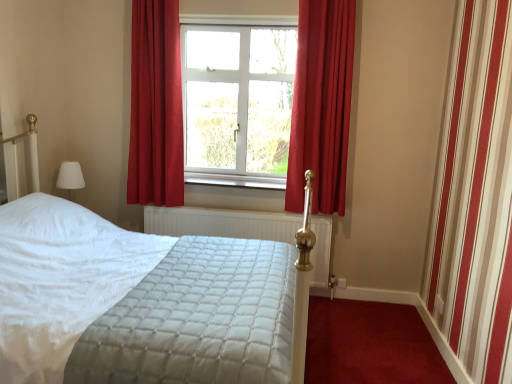
Question: Considering the positions of white quilted mattress at center and white plastic window at center in the image, is white quilted mattress at center wider or thinner than white plastic window at center?

Choices:
 (A) thin
 (B) wide

Answer: (B)

Question: Considering the positions of white quilted mattress at center and white plastic window at center in the image, is white quilted mattress at center bigger or smaller than white plastic window at center?

Choices:
 (A) small
 (B) big

Answer: (B)

Question: Which object is positioned closest to the white painted wood at center?

Choices:
 (A) white quilted mattress at center
 (B) matte red curtain at center, the second curtain from the right
 (C) white plastic window at center
 (D) white textured radiator at center
 (E) velvet red curtain at center, the first curtain viewed from the right

Answer: (D)

Question: Based on their relative distances, which object is nearer to the white quilted mattress at center?

Choices:
 (A) matte red curtain at center, arranged as the 1th curtain when viewed from the left
 (B) velvet red curtain at center, the first curtain viewed from the right
 (C) white painted wood at center
 (D) white textured radiator at center
 (E) white plastic window at center

Answer: (D)